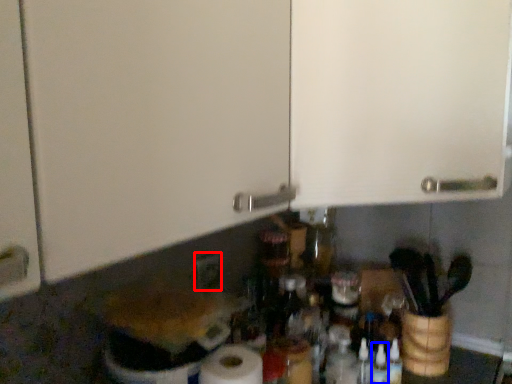
Question: Which object appears closest to the camera in this image, electric outlet (highlighted by a red box) or bottle (highlighted by a blue box)?

Choices:
 (A) electric outlet
 (B) bottle

Answer: (B)